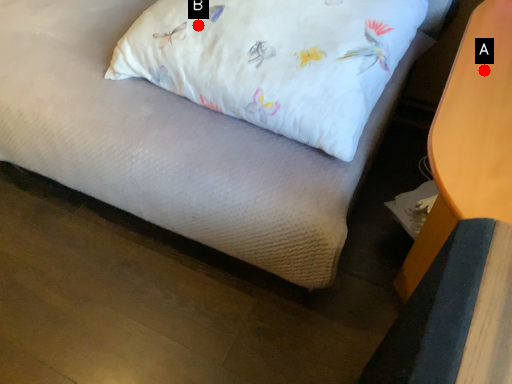
Question: Two points are circled on the image, labeled by A and B beside each circle. Which point is farther to the camera?

Choices:
 (A) A is further
 (B) B is further

Answer: (B)